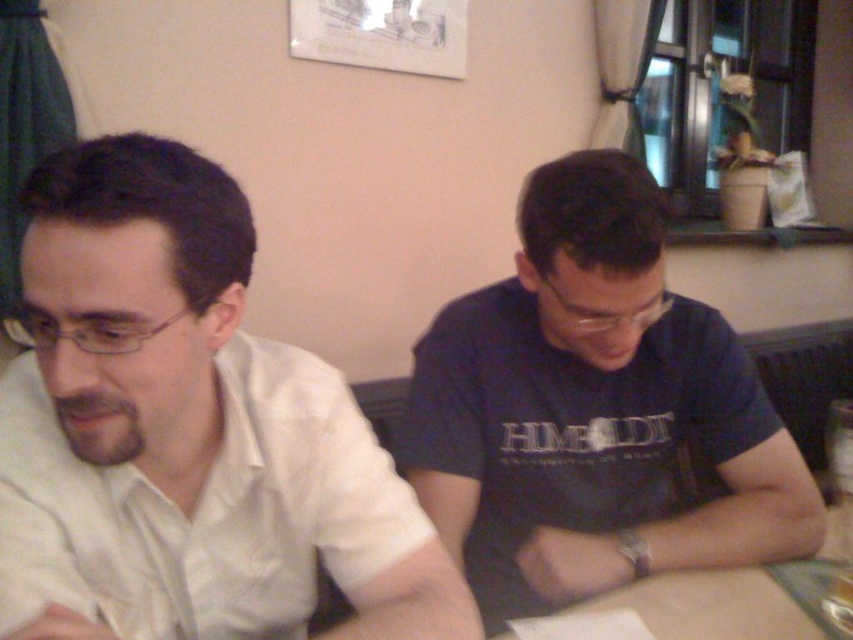
Is white satin shirt at left taller than dark blue t-shirt at center?

Incorrect, white satin shirt at left's height is not larger of dark blue t-shirt at center's.

Can you confirm if white satin shirt at left is thinner than dark blue t-shirt at center?

Yes, white satin shirt at left is thinner than dark blue t-shirt at center.

Between point (136, 476) and point (564, 576), which one is positioned in front?

Point (136, 476) is in front.

Image resolution: width=853 pixels, height=640 pixels. In order to click on white satin shirt at left in this screenshot , I will do `click(186, 433)`.